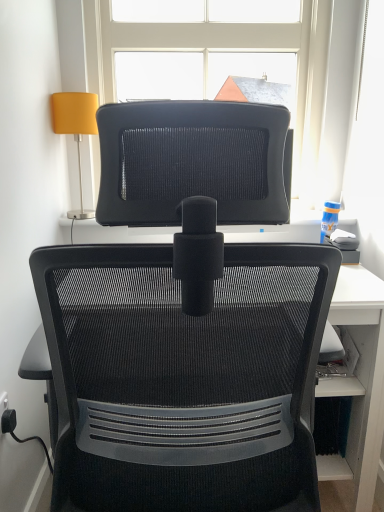
Question: From a real-world perspective, is matte yellow fabric lampshade at upper left on transparent glass window at upper center?

Choices:
 (A) yes
 (B) no

Answer: (B)

Question: From the image's perspective, would you say matte yellow fabric lampshade at upper left is positioned over transparent glass window at upper center?

Choices:
 (A) no
 (B) yes

Answer: (A)

Question: From the image's perspective, is matte yellow fabric lampshade at upper left located beneath transparent glass window at upper center?

Choices:
 (A) no
 (B) yes

Answer: (B)

Question: Is matte yellow fabric lampshade at upper left positioned before transparent glass window at upper center?

Choices:
 (A) no
 (B) yes

Answer: (B)

Question: Is matte yellow fabric lampshade at upper left wider than transparent glass window at upper center?

Choices:
 (A) no
 (B) yes

Answer: (A)

Question: Is matte yellow fabric lampshade at upper left taller or shorter than transparent glass window at upper center?

Choices:
 (A) short
 (B) tall

Answer: (A)

Question: Considering the positions of matte yellow fabric lampshade at upper left and transparent glass window at upper center in the image, is matte yellow fabric lampshade at upper left wider or thinner than transparent glass window at upper center?

Choices:
 (A) wide
 (B) thin

Answer: (B)

Question: Based on their positions, is matte yellow fabric lampshade at upper left located to the left or right of transparent glass window at upper center?

Choices:
 (A) left
 (B) right

Answer: (A)

Question: Would you say matte yellow fabric lampshade at upper left is inside or outside transparent glass window at upper center?

Choices:
 (A) inside
 (B) outside

Answer: (B)

Question: Is black plastic plug at lower left bigger or smaller than matte yellow fabric lampshade at upper left?

Choices:
 (A) big
 (B) small

Answer: (B)

Question: Is black plastic plug at lower left spatially inside matte yellow fabric lampshade at upper left, or outside of it?

Choices:
 (A) inside
 (B) outside

Answer: (B)

Question: Based on their positions, is black plastic plug at lower left located to the left or right of matte yellow fabric lampshade at upper left?

Choices:
 (A) left
 (B) right

Answer: (A)

Question: From the image's perspective, relative to matte yellow fabric lampshade at upper left, is black plastic plug at lower left above or below?

Choices:
 (A) above
 (B) below

Answer: (B)

Question: Is black mesh chair at center bigger or smaller than black plastic plug at lower left?

Choices:
 (A) big
 (B) small

Answer: (A)

Question: In the image, is black mesh chair at center positioned in front of or behind black plastic plug at lower left?

Choices:
 (A) behind
 (B) front

Answer: (B)